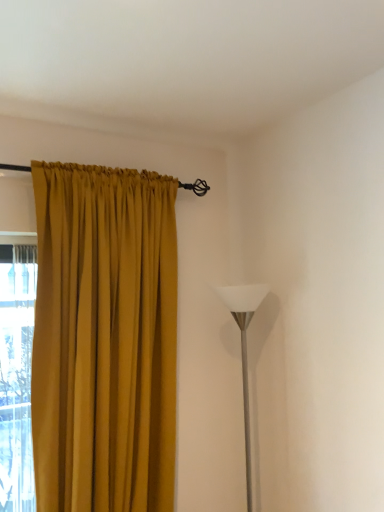
Looking at this image, what is the approximate height of white glossy floor lamp at right?

white glossy floor lamp at right is 37.59 inches tall.

Identify the location of white glossy floor lamp at right. This screenshot has height=512, width=384. point(244,350).

Image resolution: width=384 pixels, height=512 pixels. What do you see at coordinates (244, 350) in the screenshot? I see `white glossy floor lamp at right` at bounding box center [244, 350].

This screenshot has width=384, height=512. In order to click on mustard fabric curtain at left in this screenshot , I will do `click(104, 339)`.

This screenshot has height=512, width=384. Describe the element at coordinates (104, 339) in the screenshot. I see `mustard fabric curtain at left` at that location.

Locate an element on the screen. white glossy floor lamp at right is located at coordinates (244, 350).

Can you confirm if mustard fabric curtain at left is positioned to the left of white glossy floor lamp at right?

Yes.

Is mustard fabric curtain at left in front of white glossy floor lamp at right?

Yes, the depth of mustard fabric curtain at left is less than that of white glossy floor lamp at right.

Is point (33, 170) positioned before point (263, 289)?

Yes, it is.

From the image's perspective, which is below, mustard fabric curtain at left or white glossy floor lamp at right?

white glossy floor lamp at right is shown below in the image.

From a real-world perspective, is mustard fabric curtain at left physically below white glossy floor lamp at right?

No, from a real-world perspective, mustard fabric curtain at left is not beneath white glossy floor lamp at right.

Does mustard fabric curtain at left have a lesser width compared to white glossy floor lamp at right?

In fact, mustard fabric curtain at left might be wider than white glossy floor lamp at right.

Can you confirm if mustard fabric curtain at left is taller than white glossy floor lamp at right?

Yes.

Which of these two, mustard fabric curtain at left or white glossy floor lamp at right, is bigger?

With larger size is mustard fabric curtain at left.

Is mustard fabric curtain at left completely or partially outside of white glossy floor lamp at right?

Yes, mustard fabric curtain at left is located beyond the bounds of white glossy floor lamp at right.

Is mustard fabric curtain at left next to white glossy floor lamp at right and touching it?

No, mustard fabric curtain at left is not making contact with white glossy floor lamp at right.

Could you tell me if mustard fabric curtain at left is facing white glossy floor lamp at right?

No, mustard fabric curtain at left is not aimed at white glossy floor lamp at right.

What's the angular difference between mustard fabric curtain at left and white glossy floor lamp at right's facing directions?

91.1 degrees.

Locate an element on the screen. The height and width of the screenshot is (512, 384). table lamp that is below the mustard fabric curtain at left (from the image's perspective) is located at coordinates (244, 350).

Based on their positions, is white glossy floor lamp at right located to the left or right of mustard fabric curtain at left?

white glossy floor lamp at right is positioned on mustard fabric curtain at left's right side.

Is white glossy floor lamp at right in front of or behind mustard fabric curtain at left in the image?

white glossy floor lamp at right is positioned farther from the viewer than mustard fabric curtain at left.

Between point (250, 479) and point (46, 238), which one is positioned behind?

The point (250, 479) is farther from the camera.

From the image's perspective, is white glossy floor lamp at right positioned above or below mustard fabric curtain at left?

Clearly, from the image's perspective, white glossy floor lamp at right is below mustard fabric curtain at left.

In the scene shown: From a real-world perspective, who is located lower, white glossy floor lamp at right or mustard fabric curtain at left?

In real-world perspective, white glossy floor lamp at right is lower.

Between white glossy floor lamp at right and mustard fabric curtain at left, which one has larger width?

With larger width is mustard fabric curtain at left.

From their relative heights in the image, would you say white glossy floor lamp at right is taller or shorter than mustard fabric curtain at left?

Clearly, white glossy floor lamp at right is shorter compared to mustard fabric curtain at left.

Is white glossy floor lamp at right bigger or smaller than mustard fabric curtain at left?

In the image, white glossy floor lamp at right appears to be smaller than mustard fabric curtain at left.

Is white glossy floor lamp at right located outside mustard fabric curtain at left?

Yes, white glossy floor lamp at right is located beyond the bounds of mustard fabric curtain at left.

Are white glossy floor lamp at right and mustard fabric curtain at left located far from each other?

No, white glossy floor lamp at right is in close proximity to mustard fabric curtain at left.

Could you tell me if white glossy floor lamp at right is turned towards mustard fabric curtain at left?

No.

How many degrees apart are the facing directions of white glossy floor lamp at right and mustard fabric curtain at left?

The facing directions of white glossy floor lamp at right and mustard fabric curtain at left are 91.1 degrees apart.

Measure the distance from white glossy floor lamp at right to mustard fabric curtain at left.

They are 51.22 centimeters apart.

The image size is (384, 512). What are the coordinates of `curtain that is in front of the white glossy floor lamp at right` in the screenshot? It's located at (104, 339).

Where is `curtain above the white glossy floor lamp at right (from a real-world perspective)`? This screenshot has width=384, height=512. curtain above the white glossy floor lamp at right (from a real-world perspective) is located at coordinates (104, 339).

Image resolution: width=384 pixels, height=512 pixels. In order to click on table lamp behind the mustard fabric curtain at left in this screenshot , I will do `click(244, 350)`.